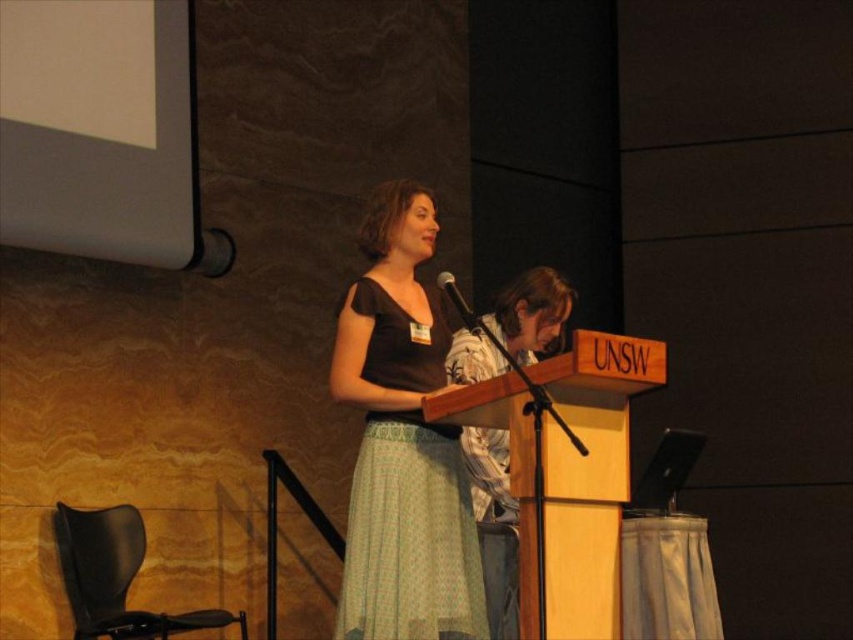
Question: Observing the image, what is the correct spatial positioning of matte black dress at center in reference to metallic silver microphone at center?

Choices:
 (A) above
 (B) below

Answer: (B)

Question: Can you confirm if matte black dress at center is thinner than metallic silver microphone at center?

Choices:
 (A) no
 (B) yes

Answer: (A)

Question: Is matte black dress at center to the left of metallic silver microphone at center from the viewer's perspective?

Choices:
 (A) yes
 (B) no

Answer: (A)

Question: Which object is farther from the camera taking this photo?

Choices:
 (A) matte black dress at center
 (B) patterned fabric shirt at center
 (C) metallic silver microphone at center

Answer: (B)

Question: Estimate the real-world distances between objects in this image. Which object is closer to the patterned fabric shirt at center?

Choices:
 (A) matte black dress at center
 (B) metallic silver microphone at center

Answer: (B)

Question: Which of the following is the closest to the observer?

Choices:
 (A) (467, 308)
 (B) (378, 529)

Answer: (A)